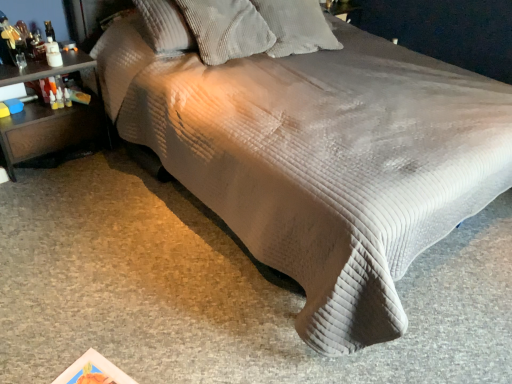
This screenshot has height=384, width=512. I want to click on vacant space to the right of brown wood nightstand at left, so click(106, 176).